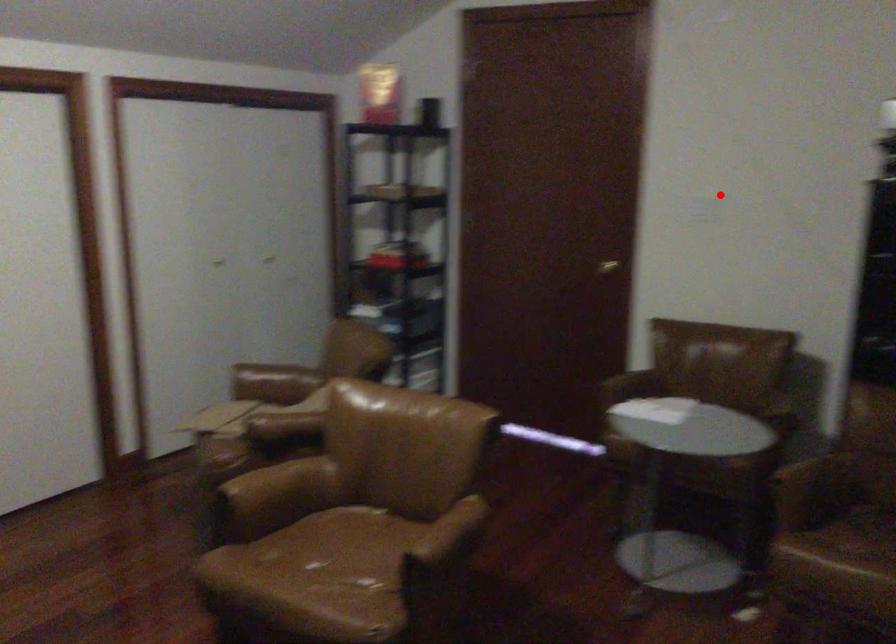
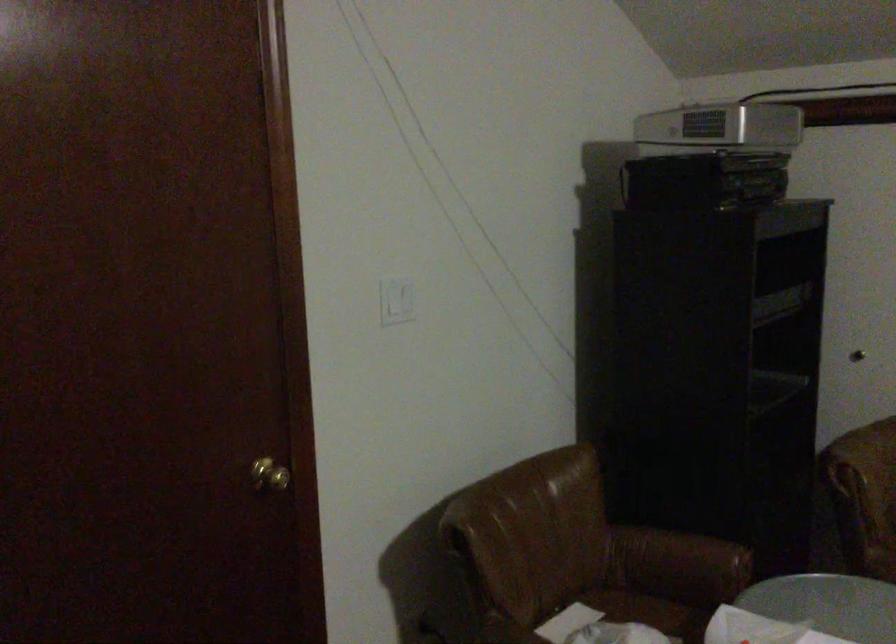
Question: I am providing you with two images of the same scene from different viewpoints. A red point is marked on the first image. Can you still see the location of the red point in image 2?

Choices:
 (A) Yes
 (B) No

Answer: (A)